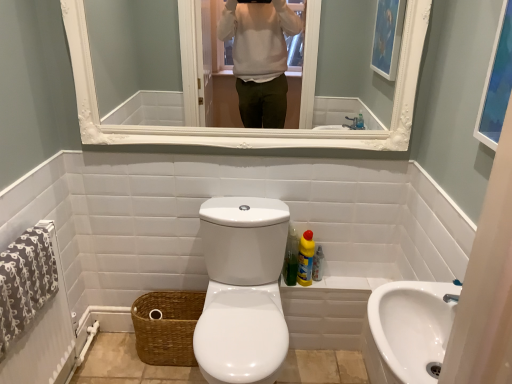
Question: From the image's perspective, is white glossy sink at lower right on white glossy toilet at center?

Choices:
 (A) yes
 (B) no

Answer: (B)

Question: Considering the relative sizes of white glossy sink at lower right and white glossy toilet at center in the image provided, is white glossy sink at lower right shorter than white glossy toilet at center?

Choices:
 (A) no
 (B) yes

Answer: (B)

Question: Is white glossy sink at lower right positioned behind white glossy toilet at center?

Choices:
 (A) no
 (B) yes

Answer: (A)

Question: Can you confirm if white glossy sink at lower right is taller than white glossy toilet at center?

Choices:
 (A) yes
 (B) no

Answer: (B)

Question: Is white glossy sink at lower right closer to the viewer compared to white glossy toilet at center?

Choices:
 (A) yes
 (B) no

Answer: (A)

Question: Is there a large distance between white glossy sink at lower right and white glossy toilet at center?

Choices:
 (A) yes
 (B) no

Answer: (B)

Question: Does blue glass picture frame at upper right appear on the left side of white glossy mirror at upper center?

Choices:
 (A) yes
 (B) no

Answer: (B)

Question: From a real-world perspective, is blue glass picture frame at upper right positioned over white glossy mirror at upper center based on gravity?

Choices:
 (A) no
 (B) yes

Answer: (B)

Question: Can you confirm if blue glass picture frame at upper right is smaller than white glossy mirror at upper center?

Choices:
 (A) no
 (B) yes

Answer: (B)

Question: From a real-world perspective, is blue glass picture frame at upper right under white glossy mirror at upper center?

Choices:
 (A) yes
 (B) no

Answer: (B)

Question: Is blue glass picture frame at upper right outside of white glossy mirror at upper center?

Choices:
 (A) no
 (B) yes

Answer: (B)

Question: From the image's perspective, is blue glass picture frame at upper right beneath white glossy mirror at upper center?

Choices:
 (A) no
 (B) yes

Answer: (B)

Question: Can you confirm if yellow liquid cleaner at lower right is thinner than white glossy mirror at upper center?

Choices:
 (A) yes
 (B) no

Answer: (B)